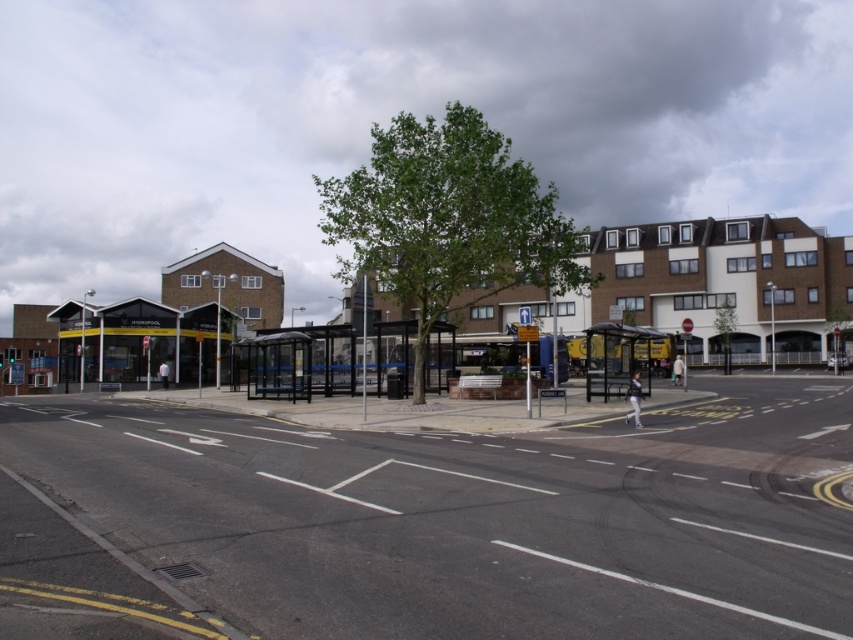
Question: Is black asphalt road at center bigger than black metal bus stop at center?

Choices:
 (A) no
 (B) yes

Answer: (A)

Question: Does black asphalt road at center have a greater width compared to black metal bus stop at center?

Choices:
 (A) no
 (B) yes

Answer: (B)

Question: Does black asphalt road at center appear under black metal bus stop at center?

Choices:
 (A) no
 (B) yes

Answer: (B)

Question: Which point is farther to the camera?

Choices:
 (A) black metal bus stop at center
 (B) black asphalt road at center

Answer: (A)